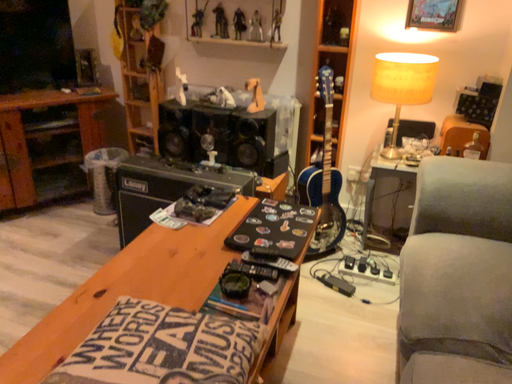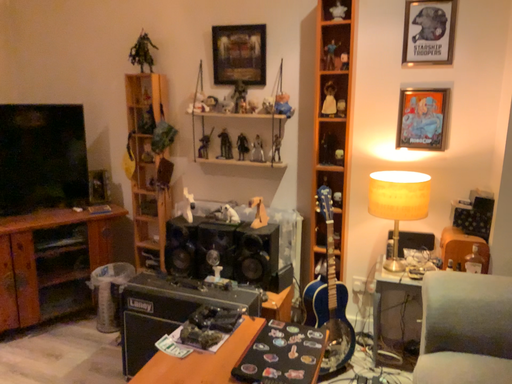
Question: Which way did the camera rotate in the video?

Choices:
 (A) rotated downward
 (B) rotated upward

Answer: (B)